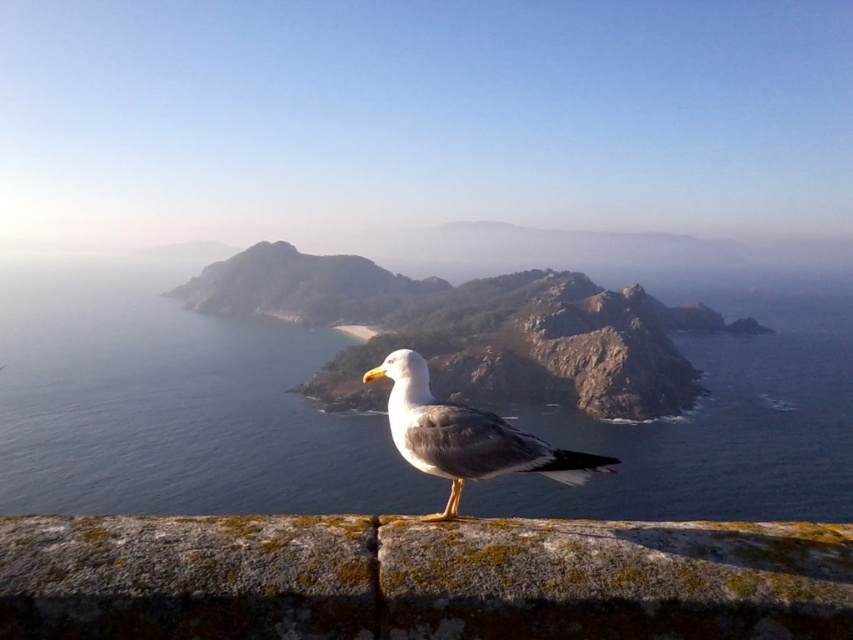
Based on the photo, you are a photographer wanting to capture the mossy stone at center and the blue water at center in a single shot. Based on their positions, which one will appear closer to the camera in the photo?

The blue water at center appears closer to the camera than the mossy stone at center because the mossy stone at center is positioned behind the blue water at center.